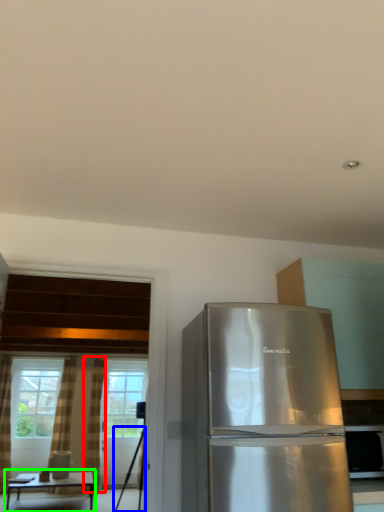
Question: Based on their relative distances, which object is nearer to curtain (highlighted by a red box)? Choose from tripod (highlighted by a blue box) and table (highlighted by a green box).

Choices:
 (A) tripod
 (B) table

Answer: (B)